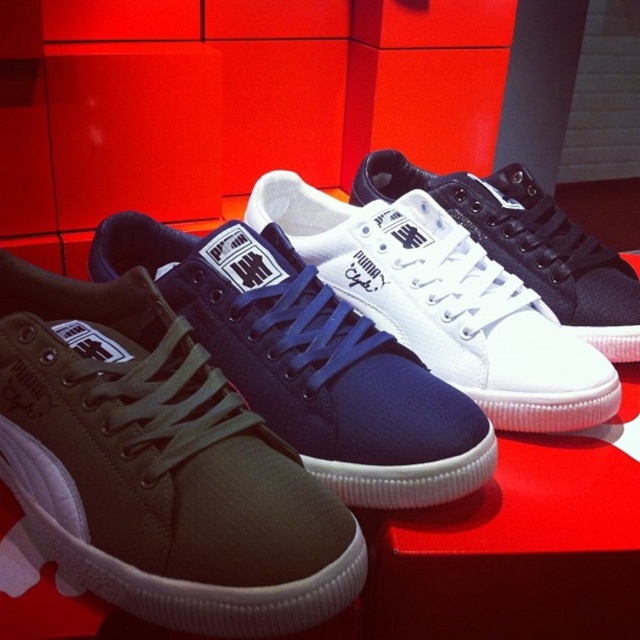
Who is higher up, olive green canvas sneaker at center or olive canvas sneaker at center?

Positioned higher is olive canvas sneaker at center.

Can you confirm if olive green canvas sneaker at center is smaller than olive canvas sneaker at center?

Yes, olive green canvas sneaker at center is smaller than olive canvas sneaker at center.

Which is behind, point (147, 529) or point (305, 296)?

Positioned behind is point (305, 296).

You are a GUI agent. You are given a task and a screenshot of the screen. Output one action in this format:
    pyautogui.click(x=<x>, y=<y>)
    Task: Click on the olive green canvas sneaker at center
    This screenshot has height=640, width=640.
    Given the screenshot: What is the action you would take?
    pyautogui.click(x=157, y=467)

Does olive canvas sneaker at center appear under navy blue canvas shoe at center?

Yes, olive canvas sneaker at center is below navy blue canvas shoe at center.

Does olive canvas sneaker at center have a lesser width compared to navy blue canvas shoe at center?

In fact, olive canvas sneaker at center might be wider than navy blue canvas shoe at center.

Locate an element on the screen. The width and height of the screenshot is (640, 640). olive canvas sneaker at center is located at coordinates (308, 362).

Which is below, olive canvas sneaker at center or white canvas sneaker at center?

Positioned lower is olive canvas sneaker at center.

Can you confirm if olive canvas sneaker at center is shorter than white canvas sneaker at center?

Yes, olive canvas sneaker at center is shorter than white canvas sneaker at center.

Image resolution: width=640 pixels, height=640 pixels. What do you see at coordinates (308, 362) in the screenshot?
I see `olive canvas sneaker at center` at bounding box center [308, 362].

You are a GUI agent. You are given a task and a screenshot of the screen. Output one action in this format:
    pyautogui.click(x=<x>, y=<y>)
    Task: Click on the olive canvas sneaker at center
    
    Given the screenshot: What is the action you would take?
    pyautogui.click(x=308, y=362)